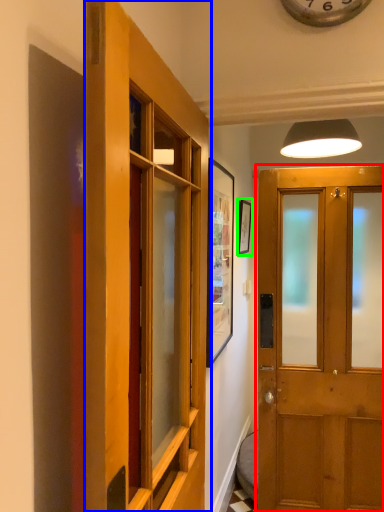
Question: Based on their relative distances, which object is nearer to door (highlighted by a red box)? Choose from door (highlighted by a blue box) and picture frame (highlighted by a green box).

Choices:
 (A) door
 (B) picture frame

Answer: (B)